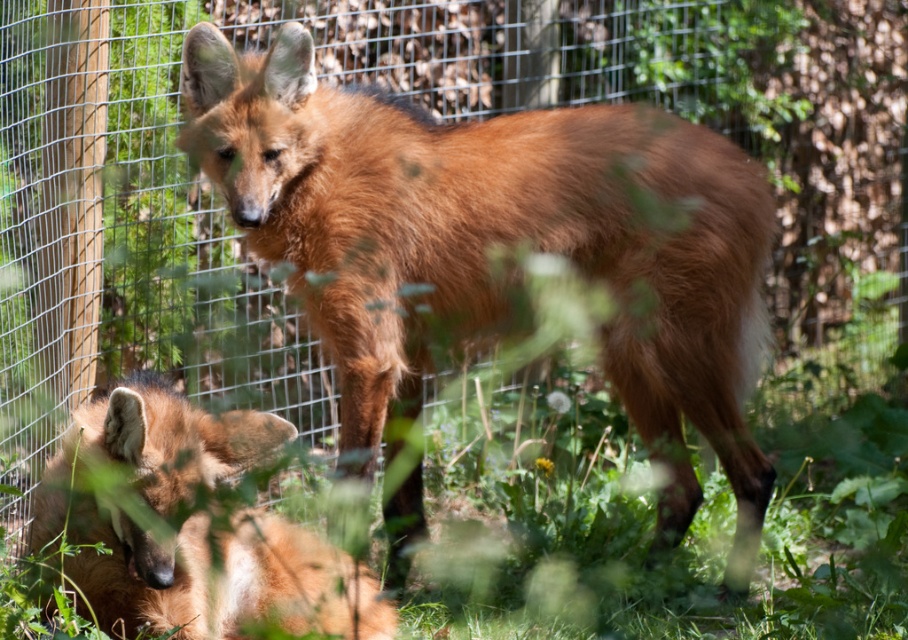
Describe the element at coordinates (497, 243) in the screenshot. The width and height of the screenshot is (908, 640). I see `brown furry fox at center` at that location.

Who is taller, brown furry fox at center or brown fur fox at lower left?

brown furry fox at center

At what (x,y) coordinates should I click in order to perform the action: click on brown furry fox at center. Please return your answer as a coordinate pair (x, y). This screenshot has height=640, width=908. Looking at the image, I should click on (497, 243).